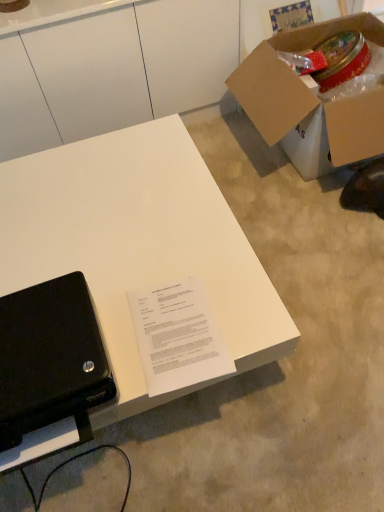
Question: Is black matte laptop at lower left further to camera compared to white matte desk at lower left?

Choices:
 (A) no
 (B) yes

Answer: (A)

Question: From the image's perspective, is black matte laptop at lower left under white matte desk at lower left?

Choices:
 (A) no
 (B) yes

Answer: (B)

Question: Is black matte laptop at lower left smaller than white matte desk at lower left?

Choices:
 (A) no
 (B) yes

Answer: (B)

Question: From the image's perspective, is black matte laptop at lower left on top of white matte desk at lower left?

Choices:
 (A) no
 (B) yes

Answer: (A)

Question: Does black matte laptop at lower left appear on the left side of white matte desk at lower left?

Choices:
 (A) no
 (B) yes

Answer: (B)

Question: Is black matte laptop at lower left positioned beyond the bounds of white matte desk at lower left?

Choices:
 (A) no
 (B) yes

Answer: (B)

Question: Is white matte desk at lower left to the left of cardboard box at upper right from the viewer's perspective?

Choices:
 (A) yes
 (B) no

Answer: (A)

Question: From the image's perspective, is white matte desk at lower left below cardboard box at upper right?

Choices:
 (A) yes
 (B) no

Answer: (A)

Question: Would you say white matte desk at lower left is a long distance from cardboard box at upper right?

Choices:
 (A) no
 (B) yes

Answer: (A)

Question: Does white matte desk at lower left have a lesser height compared to cardboard box at upper right?

Choices:
 (A) no
 (B) yes

Answer: (B)

Question: Is white matte desk at lower left wider than cardboard box at upper right?

Choices:
 (A) yes
 (B) no

Answer: (A)

Question: Is white matte desk at lower left facing towards cardboard box at upper right?

Choices:
 (A) yes
 (B) no

Answer: (B)

Question: Considering the relative sizes of cardboard box at upper right and black matte laptop at lower left in the image provided, is cardboard box at upper right smaller than black matte laptop at lower left?

Choices:
 (A) yes
 (B) no

Answer: (B)